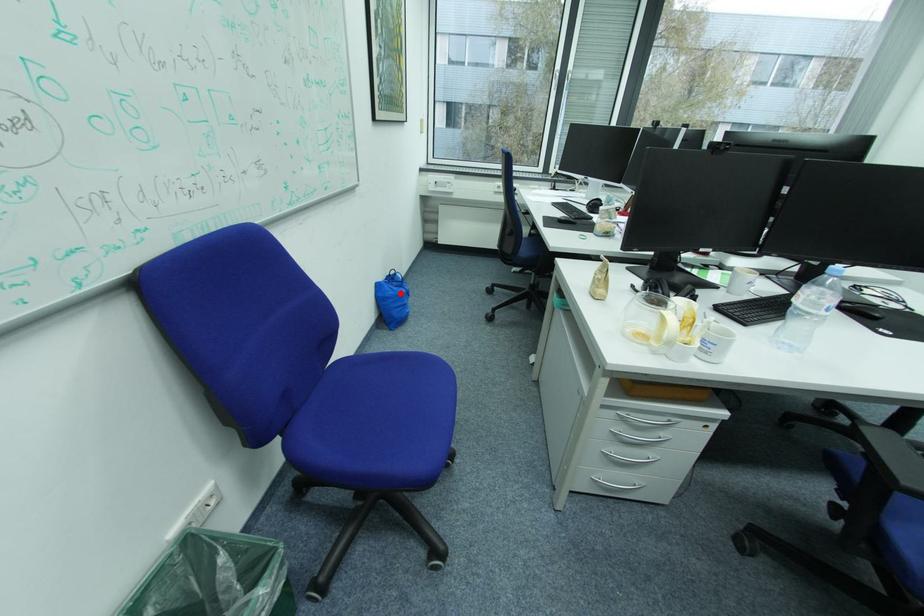
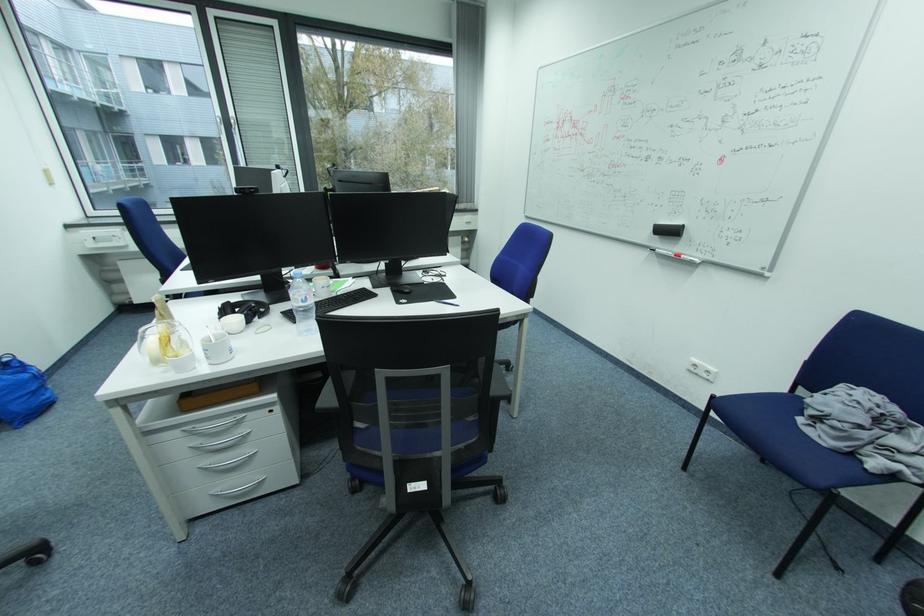
Question: I am providing you with two images of the same scene from different viewpoints. Given a red point in image1, look at the same physical point in image2. Is it:

Choices:
 (A) Closer to the viewpoint
 (B) Farther from the viewpoint

Answer: (B)